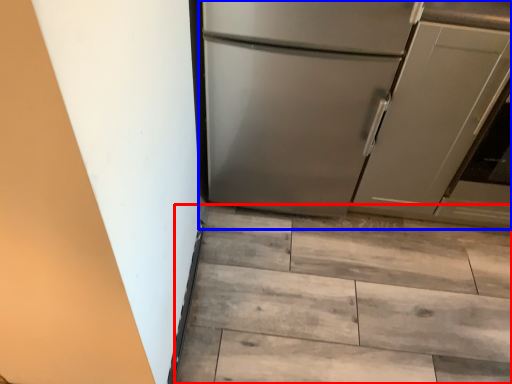
Question: Which object is closer to the camera taking this photo, stairwell (highlighted by a red box) or refrigerator (highlighted by a blue box)?

Choices:
 (A) stairwell
 (B) refrigerator

Answer: (B)